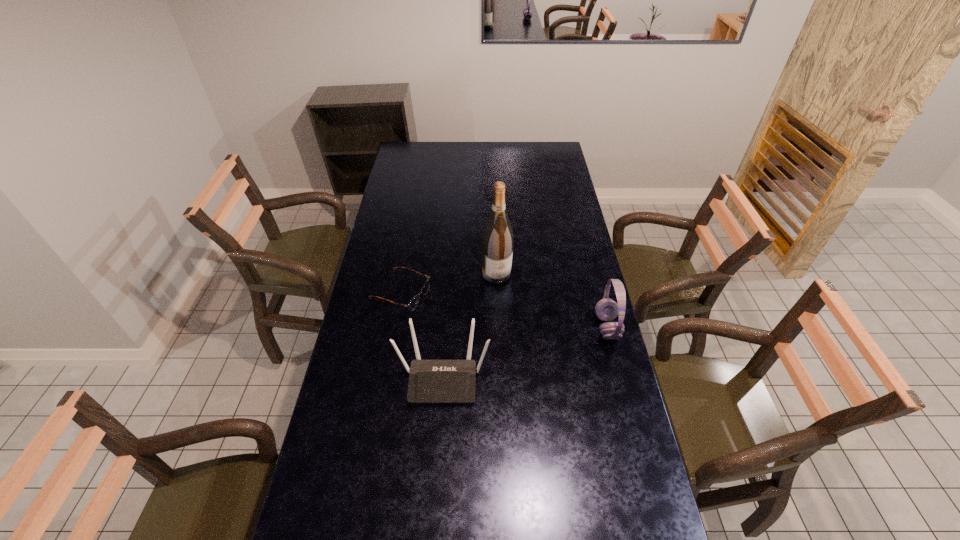
The width and height of the screenshot is (960, 540). I want to click on vacant space at the near left corner of the desktop, so click(x=315, y=495).

Locate an element on the screen. Image resolution: width=960 pixels, height=540 pixels. free space at the near right corner of the desktop is located at coordinates (650, 503).

The height and width of the screenshot is (540, 960). Find the location of `vacant area that lies between the wine bottle and the spectacles`. vacant area that lies between the wine bottle and the spectacles is located at coordinates click(x=449, y=284).

The height and width of the screenshot is (540, 960). Find the location of `empty space that is in between the headset and the wine bottle`. empty space that is in between the headset and the wine bottle is located at coordinates (552, 300).

Image resolution: width=960 pixels, height=540 pixels. In order to click on blank region between the rightmost object and the router in this screenshot , I will do `click(525, 352)`.

You are a GUI agent. You are given a task and a screenshot of the screen. Output one action in this format:
    pyautogui.click(x=<x>, y=<y>)
    Task: Click on the free area in between the router and the rightmost object
    This screenshot has width=960, height=540.
    Given the screenshot: What is the action you would take?
    pyautogui.click(x=525, y=352)

Identify the location of free spot between the nearest object and the wine bottle. The width and height of the screenshot is (960, 540). (469, 325).

At what (x,y) coordinates should I click in order to perform the action: click on free spot between the rightmost object and the nearest object. Please return your answer as a coordinate pair (x, y). Looking at the image, I should click on (525, 352).

The width and height of the screenshot is (960, 540). Find the location of `free area in between the tallest object and the headset`. free area in between the tallest object and the headset is located at coordinates tap(552, 300).

The height and width of the screenshot is (540, 960). I want to click on free spot between the wine bottle and the shortest object, so click(449, 284).